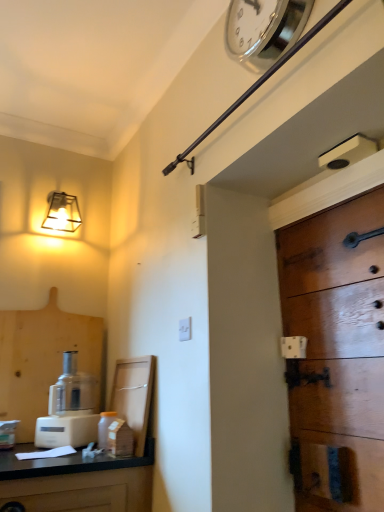
Question: From a real-world perspective, relative to white plastic light switch at center, is translucent glass jar at lower left vertically above or below?

Choices:
 (A) below
 (B) above

Answer: (A)

Question: Considering the positions of point (104, 429) and point (187, 318), is point (104, 429) closer or farther from the camera than point (187, 318)?

Choices:
 (A) farther
 (B) closer

Answer: (A)

Question: Based on their relative distances, which object is nearer to the silver metallic clock at upper center?

Choices:
 (A) white plastic food processor at lower left
 (B) wooden cabinet at lower left
 (C) translucent glass jar at lower left
 (D) wooden door at right
 (E) metallic square lamp at upper left

Answer: (D)

Question: Estimate the real-world distances between objects in this image. Which object is farther from the white plastic light switch at center?

Choices:
 (A) wooden door at right
 (B) translucent glass jar at lower left
 (C) metallic square lamp at upper left
 (D) wooden cabinet at lower left
 (E) white plastic food processor at lower left

Answer: (C)